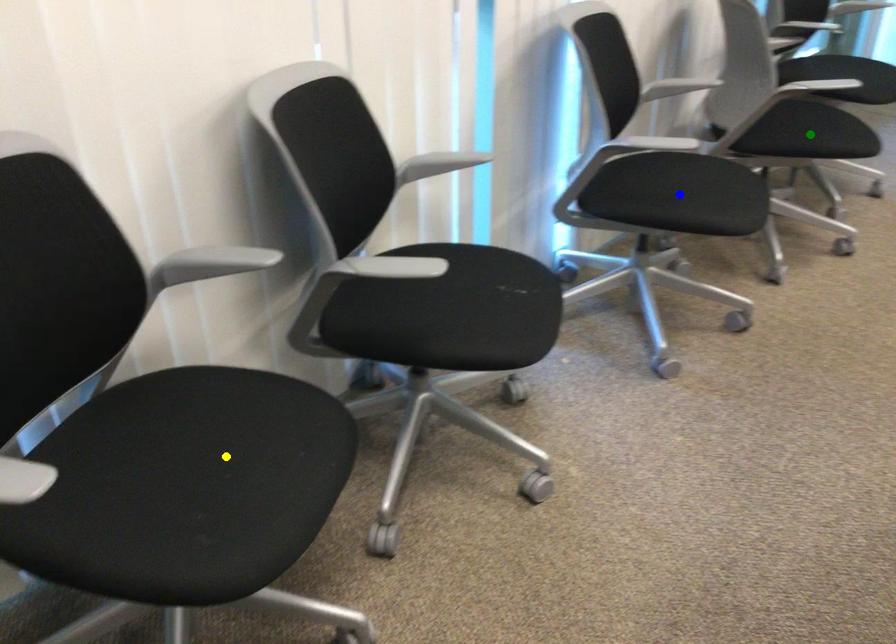
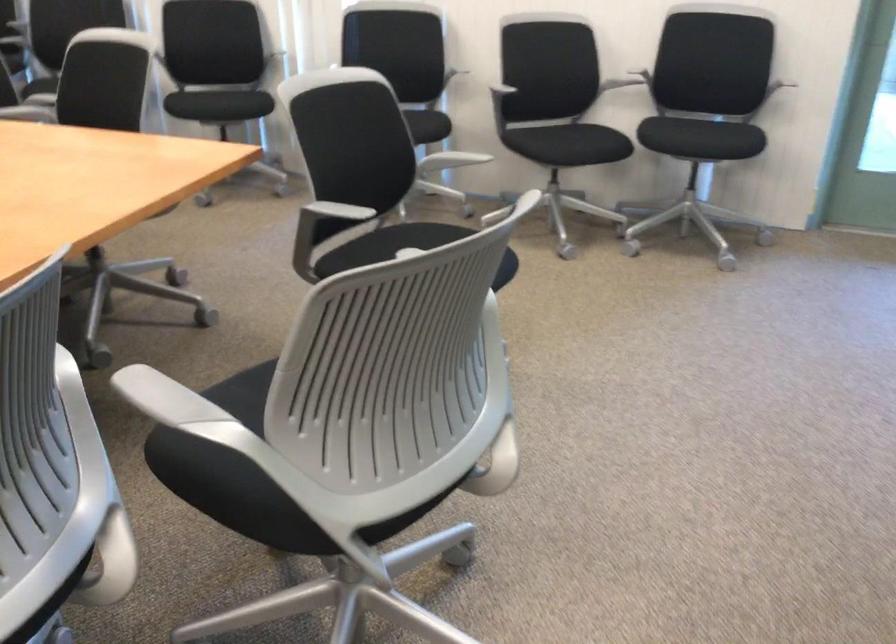
I am providing you with two images of the same scene from different viewpoints. Three points are marked in image1. Which point corresponds to a part or object that is occluded in image2?In image1, three points are marked. Which of them correspond to a part or object that is occluded in image2?Among the three points shown in image1, which one corresponds to a part or object that is no longer visible due to occlusion in image2?

blue point, green point, yellow point cannot be seen in image2.